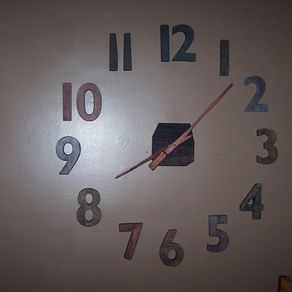
Find the location of a particular element. The height and width of the screenshot is (292, 292). clock face is located at coordinates (186, 190).